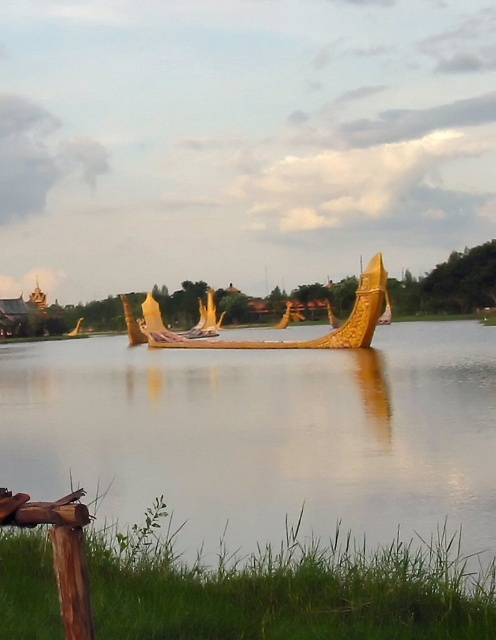
You are standing on the lakeside and want to determine which object is closer to the horizon. Based on the scene, which one between the smooth gold water at center and the gold polished wood boat at center is closer to the horizon?

The smooth gold water at center is shorter than the gold polished wood boat at center, so the boat is closer to the horizon than the water.

You are standing on the lakeside and see the smooth gold water at center and the gold polished wood boat at center. Which object is located below the other?

The smooth gold water at center is positioned under the gold polished wood boat at center.